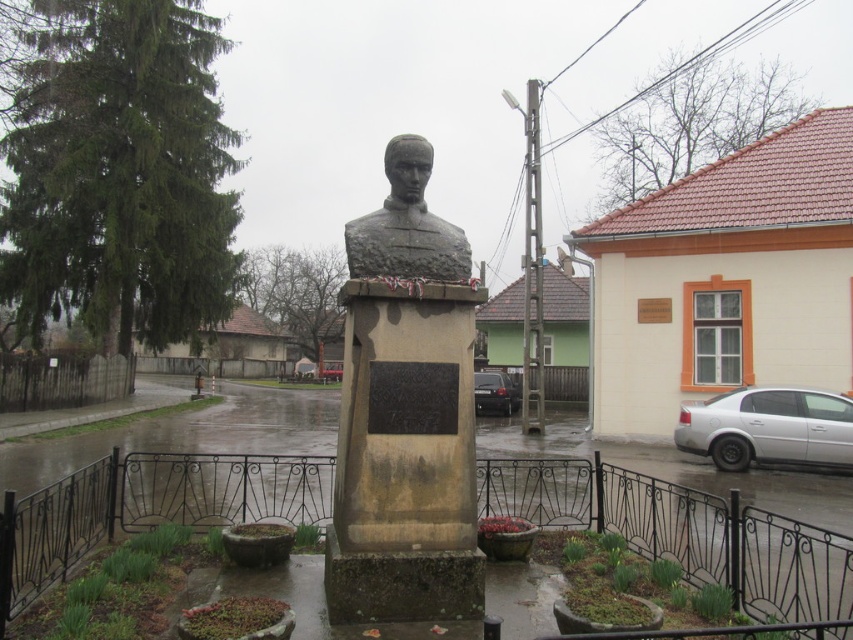
Measure the distance between silver metallic car at lower right and camera.

silver metallic car at lower right is 40.98 feet away from camera.

Between point (734, 416) and point (462, 236), which one is positioned in front?

Point (462, 236)

Which is in front, point (714, 396) or point (424, 275)?

Point (424, 275) is more forward.

Where is `silver metallic car at lower right`? The image size is (853, 640). silver metallic car at lower right is located at coordinates (769, 428).

Describe the element at coordinates (405, 412) in the screenshot. I see `stone bust at center` at that location.

Who is shorter, stone bust at center or black glossy car at center?

With less height is stone bust at center.

Who is more forward, (366, 532) or (485, 412)?

Point (366, 532)

Find the location of `stone bust at center`. stone bust at center is located at coordinates (405, 412).

Measure the distance from slate stone bust at center to black glossy car at center.

The distance of slate stone bust at center from black glossy car at center is 39.37 feet.

Who is taller, slate stone bust at center or black glossy car at center?

slate stone bust at center

Is point (397, 244) farther from viewer compared to point (514, 396)?

No, (397, 244) is closer to viewer.

Identify the location of slate stone bust at center. This screenshot has height=640, width=853. (405, 225).